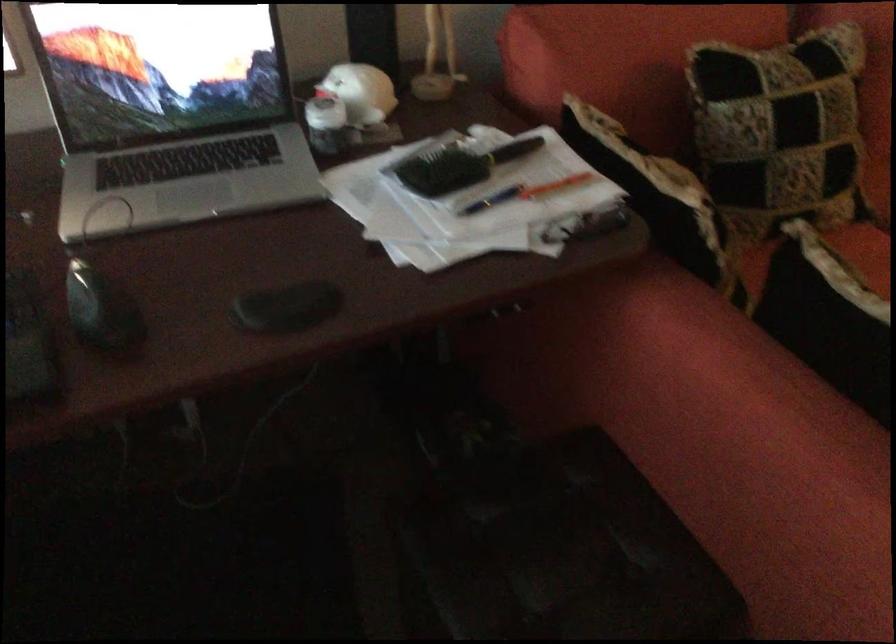
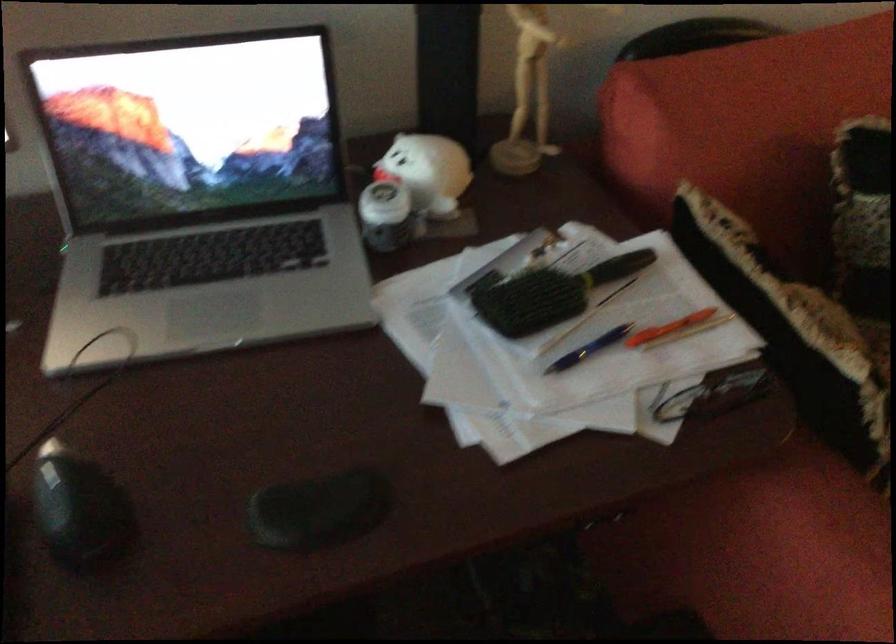
In the second image, find the point that corresponds to point 493,202 in the first image.

(589, 348)